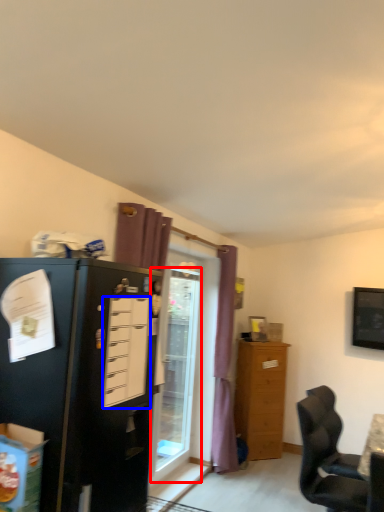
Question: Which object appears farthest to the camera in this image, glass door (highlighted by a red box) or drawer (highlighted by a blue box)?

Choices:
 (A) glass door
 (B) drawer

Answer: (A)